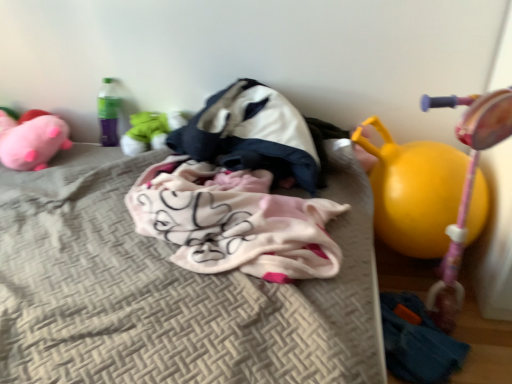
Measure the distance between point (408,242) and camera.

Point (408,242) and camera are 4.38 feet apart.

What is the approximate height of pink plush toy at left, the 1th toy in the left-to-right sequence?

pink plush toy at left, the 1th toy in the left-to-right sequence, is 5.54 inches tall.

Image resolution: width=512 pixels, height=384 pixels. In order to click on beige textured mattress at center in this screenshot , I will do `click(170, 289)`.

Could you tell me if yellow rubber ball at right is turned towards fluffy pink blanket at center?

No.

This screenshot has height=384, width=512. I want to click on baby clothe located above the yellow rubber ball at right (from the image's perspective), so click(x=234, y=222).

Would you say fluffy pink blanket at center is part of yellow rubber ball at right's contents?

No, yellow rubber ball at right does not contain fluffy pink blanket at center.

Does yellow rubber ball at right have a larger size compared to fluffy pink blanket at center?

Indeed, yellow rubber ball at right has a larger size compared to fluffy pink blanket at center.

From the image's perspective, who appears lower, beige textured mattress at center or white and navy blue fabric sleeping bag at center?

beige textured mattress at center, from the image's perspective.

Is point (120, 365) positioned before point (293, 161)?

Yes.

From a real-world perspective, who is located lower, beige textured mattress at center or white and navy blue fabric sleeping bag at center?

In real-world perspective, beige textured mattress at center is lower.

From the image's perspective, between beige textured mattress at center and pink plush toy at left, placed as the 3th toy when sorted from right to left, which one is located above?

pink plush toy at left, placed as the 3th toy when sorted from right to left, from the image's perspective.

Could you tell me if beige textured mattress at center is turned towards pink plush toy at left, the 1th toy in the left-to-right sequence?

No.

Does beige textured mattress at center have a smaller size compared to pink plush toy at left, the 1th toy in the left-to-right sequence?

Incorrect, beige textured mattress at center is not smaller in size than pink plush toy at left, the 1th toy in the left-to-right sequence.

Is beige textured mattress at center surrounding pink plush toy at left, the 1th toy in the left-to-right sequence?

Yes, pink plush toy at left, the 1th toy in the left-to-right sequence, can be found within beige textured mattress at center.

Which of these two, soft plush toy at center, the 2th toy in the right-to-left sequence, or yellow rubber ball at right, placed as the 1th toy when sorted from right to left, is smaller?

soft plush toy at center, the 2th toy in the right-to-left sequence.

From the image's perspective, would you say soft plush toy at center, positioned as the second toy in left-to-right order, is shown under yellow rubber ball at right, the 3th toy when ordered from left to right?

Incorrect, from the image's perspective, soft plush toy at center, positioned as the second toy in left-to-right order, is higher than yellow rubber ball at right, the 3th toy when ordered from left to right.

From the image's perspective, which toy is the 2nd one above the yellow rubber ball at right, placed as the 1th toy when sorted from right to left? Please provide its 2D coordinates.

[(150, 131)]

Does yellow rubber ball at right, the 3th toy when ordered from left to right, have a smaller size compared to fluffy pink blanket at center?

Yes, yellow rubber ball at right, the 3th toy when ordered from left to right, is smaller than fluffy pink blanket at center.

Is fluffy pink blanket at center surrounded by yellow rubber ball at right, the 3th toy when ordered from left to right?

That's incorrect, fluffy pink blanket at center is not inside yellow rubber ball at right, the 3th toy when ordered from left to right.

From the image's perspective, is yellow rubber ball at right, placed as the 1th toy when sorted from right to left, located beneath fluffy pink blanket at center?

Actually, yellow rubber ball at right, placed as the 1th toy when sorted from right to left, appears above fluffy pink blanket at center in the image.

Does yellow rubber ball at right, the 3th toy when ordered from left to right, have a lesser height compared to fluffy pink blanket at center?

No, yellow rubber ball at right, the 3th toy when ordered from left to right, is not shorter than fluffy pink blanket at center.

From the picture: Could yellow rubber ball at right, placed as the 1th toy when sorted from right to left, be considered to be inside fluffy pink blanket at center?

That's incorrect, yellow rubber ball at right, placed as the 1th toy when sorted from right to left, is not inside fluffy pink blanket at center.

Measure the distance between fluffy pink blanket at center and yellow rubber ball at right, the 3th toy when ordered from left to right.

fluffy pink blanket at center is 15.40 inches from yellow rubber ball at right, the 3th toy when ordered from left to right.

The height and width of the screenshot is (384, 512). What are the coordinates of `baby clothe that appears on the left of yellow rubber ball at right, placed as the 1th toy when sorted from right to left` in the screenshot? It's located at (234, 222).

Which object is positioned more to the right, yellow rubber ball at right, the 3th toy when ordered from left to right, or beige textured mattress at center?

yellow rubber ball at right, the 3th toy when ordered from left to right.

Does yellow rubber ball at right, the 3th toy when ordered from left to right, turn towards beige textured mattress at center?

No.

What's the angular difference between yellow rubber ball at right, the 3th toy when ordered from left to right, and beige textured mattress at center's facing directions?

The facing directions of yellow rubber ball at right, the 3th toy when ordered from left to right, and beige textured mattress at center are 91.1 degrees apart.

Find the location of a particular element. The image size is (512, 384). the 2nd toy to the right when counting from the beige textured mattress at center is located at coordinates (414, 191).

Find the location of `baby carriage to the right of fluffy pink blanket at center`. baby carriage to the right of fluffy pink blanket at center is located at coordinates (466, 189).

This screenshot has width=512, height=384. Find the location of `mattress that is below the white and navy blue fabric sleeping bag at center (from the image's perspective)`. mattress that is below the white and navy blue fabric sleeping bag at center (from the image's perspective) is located at coordinates (170, 289).

Looking at the image, which one is located further to soft plush toy at center, positioned as the second toy in left-to-right order, yellow rubber ball at right, the 3th toy when ordered from left to right, or yellow rubber ball at right?

yellow rubber ball at right is positioned further to the anchor soft plush toy at center, positioned as the second toy in left-to-right order.

Which object lies nearer to the anchor point pink plush toy at left, placed as the 3th toy when sorted from right to left, fluffy pink blanket at center or soft plush toy at center, the 2th toy in the right-to-left sequence?

soft plush toy at center, the 2th toy in the right-to-left sequence.

From the picture: Estimate the real-world distances between objects in this image. Which object is further from white and navy blue fabric sleeping bag at center, soft plush toy at center, positioned as the second toy in left-to-right order, or yellow rubber ball at right, the 3th toy when ordered from left to right?

yellow rubber ball at right, the 3th toy when ordered from left to right, is further to white and navy blue fabric sleeping bag at center.

Based on their spatial positions, is soft plush toy at center, positioned as the second toy in left-to-right order, or yellow rubber ball at right, placed as the 1th toy when sorted from right to left, closer to yellow rubber ball at right?

Based on the image, yellow rubber ball at right, placed as the 1th toy when sorted from right to left, appears to be nearer to yellow rubber ball at right.

Looking at the image, which one is located further to fluffy pink blanket at center, beige textured mattress at center or soft plush toy at center, positioned as the second toy in left-to-right order?

soft plush toy at center, positioned as the second toy in left-to-right order.

Consider the image. Based on their spatial positions, is beige textured mattress at center or pink plush toy at left, placed as the 3th toy when sorted from right to left, further from soft plush toy at center, the 2th toy in the right-to-left sequence?

beige textured mattress at center.

Estimate the real-world distances between objects in this image. Which object is closer to yellow rubber ball at right, the 3th toy when ordered from left to right, yellow rubber ball at right or fluffy pink blanket at center?

Among the two, yellow rubber ball at right is located nearer to yellow rubber ball at right, the 3th toy when ordered from left to right.

Looking at the image, which one is located closer to pink plush toy at left, the 1th toy in the left-to-right sequence, beige textured mattress at center or white and navy blue fabric sleeping bag at center?

beige textured mattress at center.

In order to click on baby clothe between pink plush toy at left, the 1th toy in the left-to-right sequence, and yellow rubber ball at right in this screenshot , I will do `click(234, 222)`.

Where is `sleeping bag between fluffy pink blanket at center and yellow rubber ball at right, the 3th toy when ordered from left to right, from left to right`? sleeping bag between fluffy pink blanket at center and yellow rubber ball at right, the 3th toy when ordered from left to right, from left to right is located at coordinates (251, 134).

You are a GUI agent. You are given a task and a screenshot of the screen. Output one action in this format:
    pyautogui.click(x=<x>, y=<y>)
    Task: Click on the toy between pink plush toy at left, placed as the 3th toy when sorted from right to left, and white and navy blue fabric sleeping bag at center from left to right
    This screenshot has width=512, height=384.
    Given the screenshot: What is the action you would take?
    pyautogui.click(x=150, y=131)

The height and width of the screenshot is (384, 512). Find the location of `sleeping bag between soft plush toy at center, the 2th toy in the right-to-left sequence, and yellow rubber ball at right, in the horizontal direction`. sleeping bag between soft plush toy at center, the 2th toy in the right-to-left sequence, and yellow rubber ball at right, in the horizontal direction is located at coordinates (251, 134).